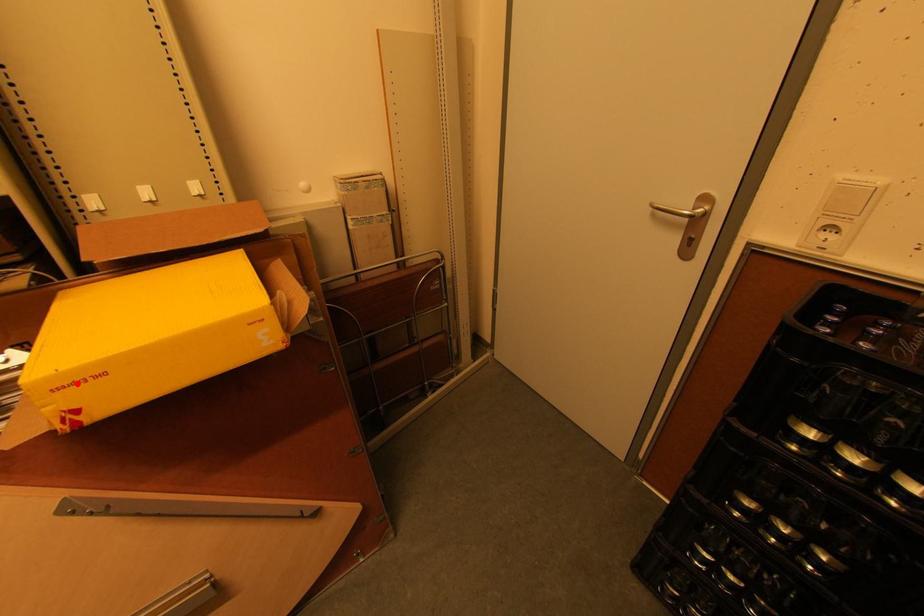
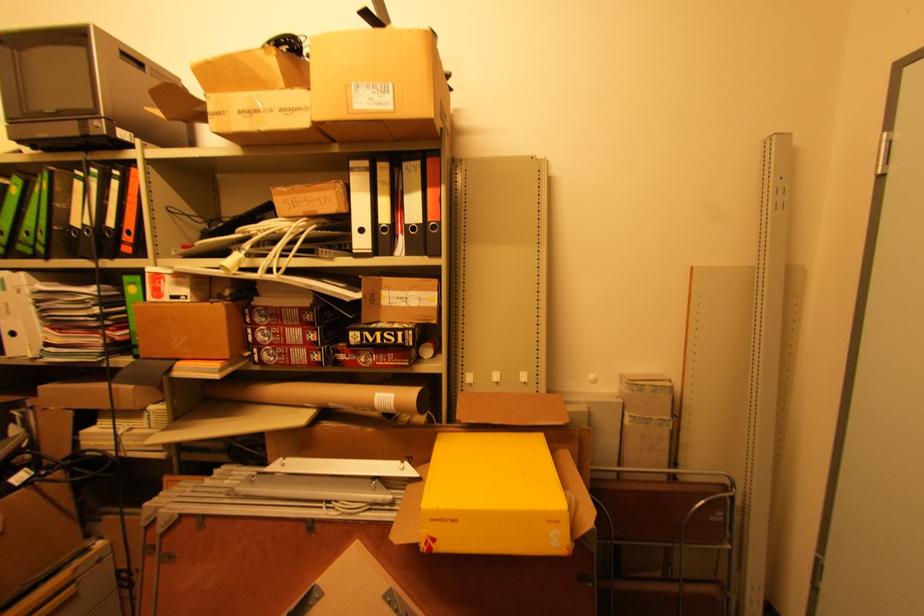
Question: I am providing you with two images of the same scene from different viewpoints. A red point is shown in image1. For the corresponding object point in image2, is it positioned nearer or farther from the camera?

Choices:
 (A) Nearer
 (B) Farther

Answer: (B)